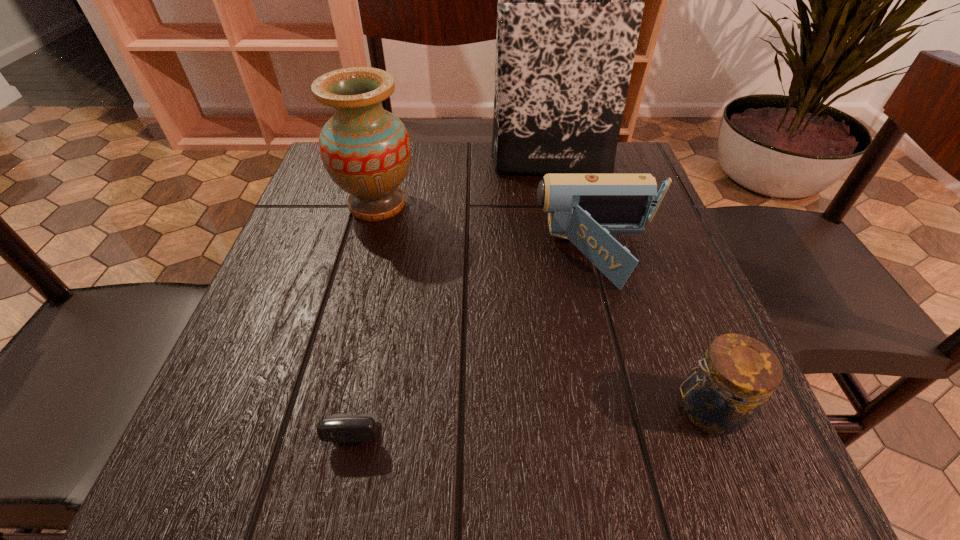
Locate an element on the screen. The image size is (960, 540). free region located 0.100m on the side of the camcorder with the flip-out screen is located at coordinates (482, 256).

The image size is (960, 540). Identify the location of vacant space located 0.220m on the lid of the jar. (512, 409).

Locate an element on the screen. Image resolution: width=960 pixels, height=540 pixels. vacant space located on the lid of the jar is located at coordinates (389, 409).

Where is `free space located 0.380m on the lid of the jar`? The height and width of the screenshot is (540, 960). free space located 0.380m on the lid of the jar is located at coordinates (396, 409).

The width and height of the screenshot is (960, 540). What are the coordinates of `vacant region located 0.050m on the front-facing side of the shortest object` in the screenshot? It's located at (334, 490).

Identify the location of shopping bag at the far edge. The height and width of the screenshot is (540, 960). (569, 11).

Where is `vase located at the far edge`? vase located at the far edge is located at coordinates (366, 150).

You are a GUI agent. You are given a task and a screenshot of the screen. Output one action in this format:
    pyautogui.click(x=<x>, y=<y>)
    Task: Click on the jar located in the near edge section of the desktop
    Image resolution: width=960 pixels, height=540 pixels.
    Given the screenshot: What is the action you would take?
    pyautogui.click(x=725, y=390)

The width and height of the screenshot is (960, 540). I want to click on webcam situated at the near edge, so click(344, 428).

This screenshot has width=960, height=540. I want to click on vase at the left edge, so click(366, 150).